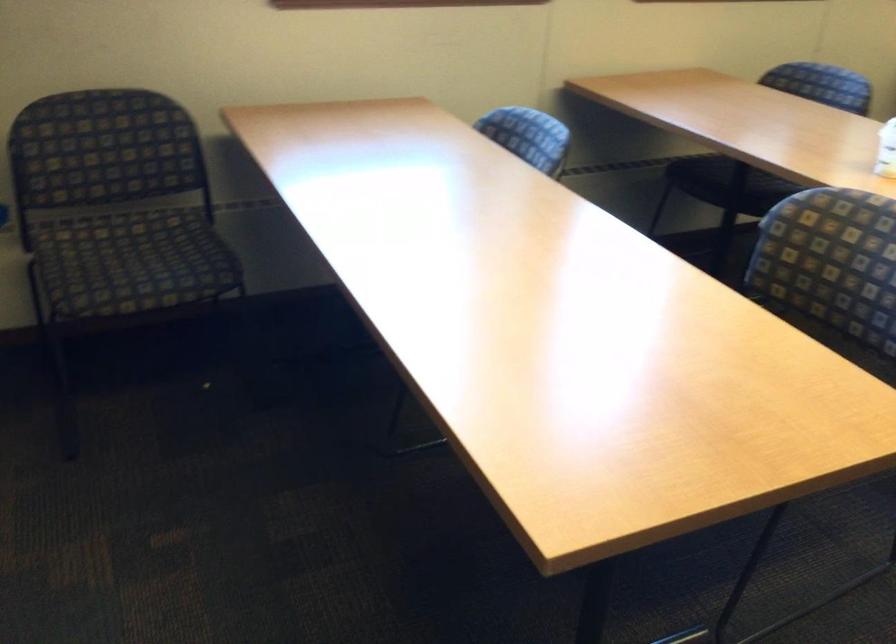
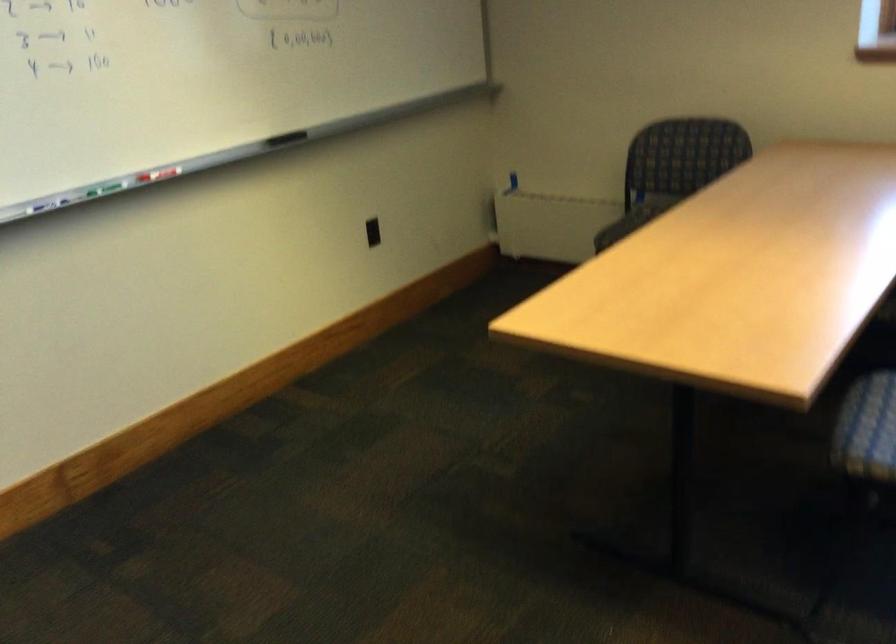
Question: I am providing you with two images of the same scene from different viewpoints. Which of the following objects are not visible in image2?

Choices:
 (A) black whiteboard eraser
 (B) black power outlet
 (C) green cart handle
 (D) chair sitting surface

Answer: (D)